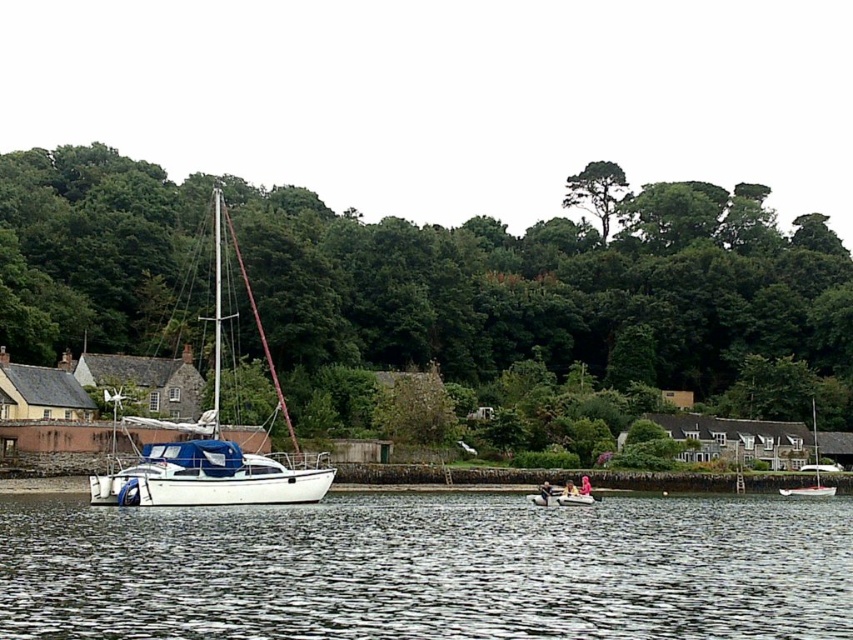
Question: Does green leafy tree at upper center have a greater width compared to white plastic kayak at center?

Choices:
 (A) no
 (B) yes

Answer: (B)

Question: Can you confirm if white glossy sailboat at right is bigger than white plastic kayak at center?

Choices:
 (A) no
 (B) yes

Answer: (B)

Question: Among these points, which one is farthest from the camera?

Choices:
 (A) (115, 483)
 (B) (383, 262)
 (C) (590, 497)
 (D) (581, 182)

Answer: (D)

Question: Which of the following is the closest to the observer?

Choices:
 (A) green leafy tree at upper center
 (B) clear water at center

Answer: (B)

Question: Which point is closer to the camera?

Choices:
 (A) (265, 465)
 (B) (648, 499)
 (C) (569, 486)
 (D) (822, 465)

Answer: (A)

Question: Is clear water at center bigger than white plastic kayak at center?

Choices:
 (A) yes
 (B) no

Answer: (A)